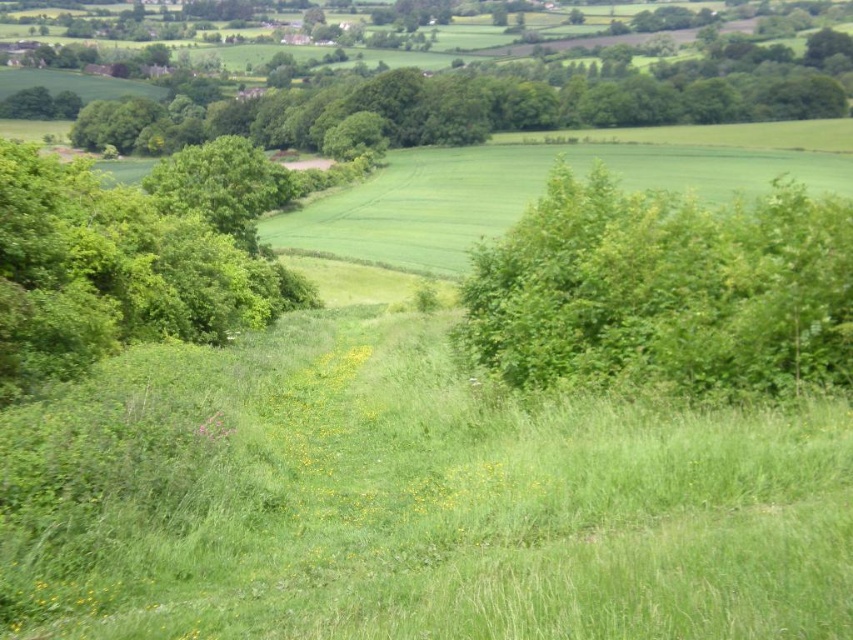
Looking at this image, is green leafy bush at right in front of green leafy tree at left?

Yes.

In order to click on green leafy bush at right in this screenshot , I will do `click(665, 291)`.

What do you see at coordinates (665, 291) in the screenshot?
I see `green leafy bush at right` at bounding box center [665, 291].

Where is `green leafy bush at right`? This screenshot has height=640, width=853. green leafy bush at right is located at coordinates (665, 291).